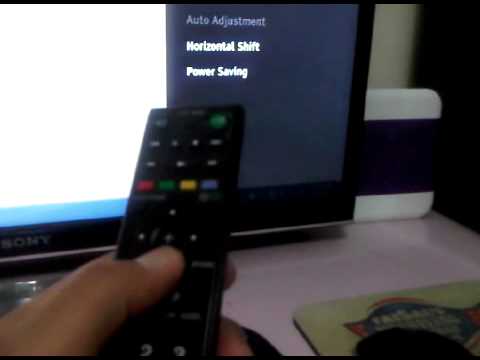
Locate an element on the screen. This screenshot has height=360, width=480. desk area is located at coordinates (393, 248), (283, 330).